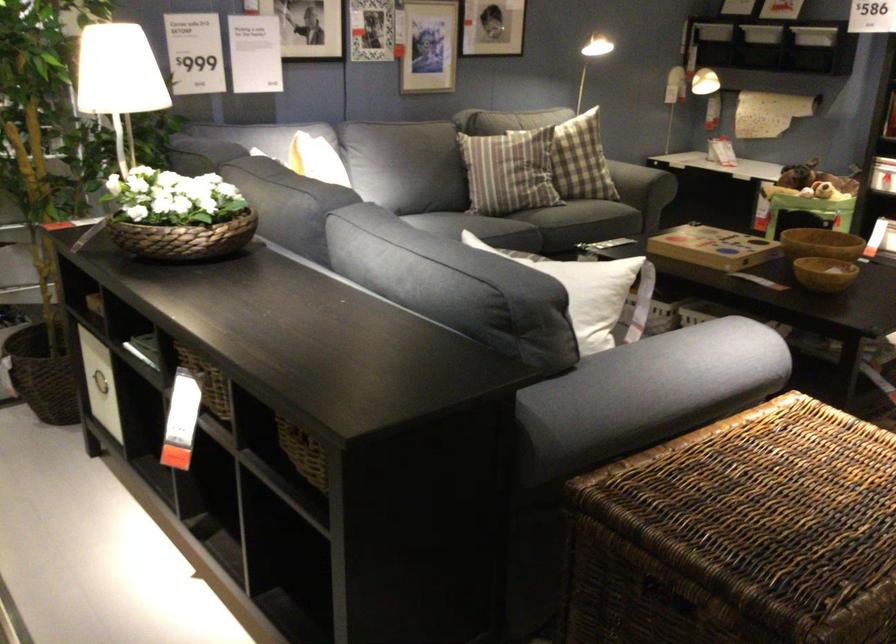
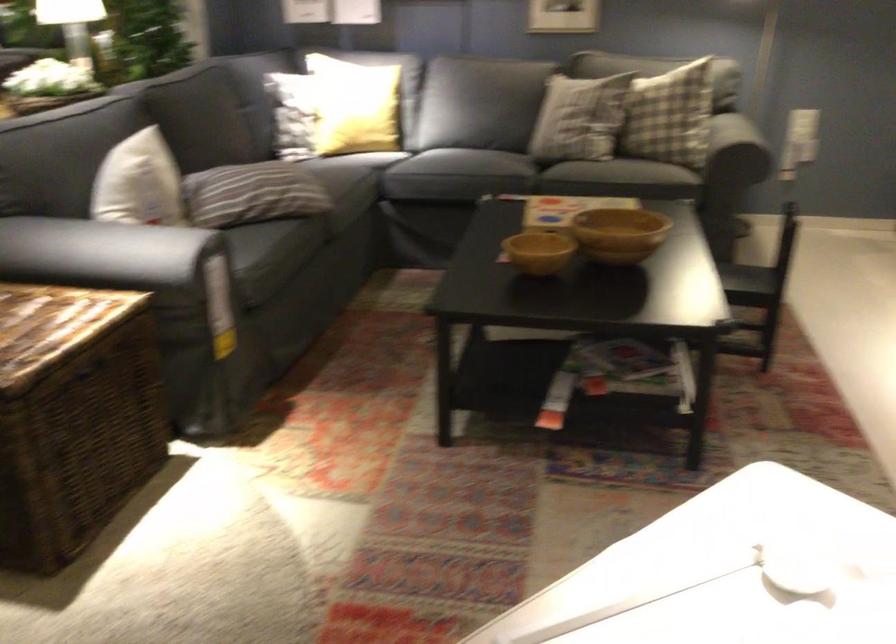
The point at (685, 351) is marked in the first image. Where is the corresponding point in the second image?

(117, 252)